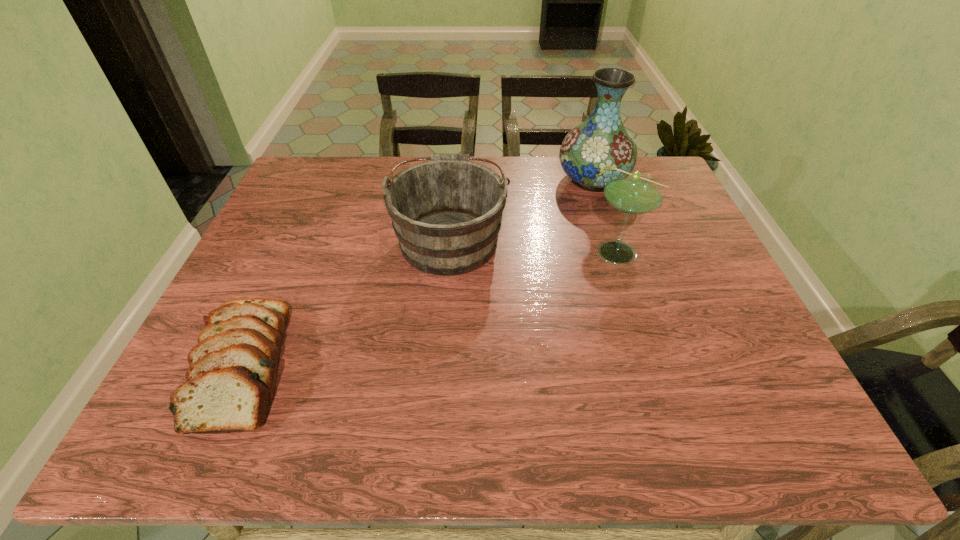
Identify the location of free space between the martini and the tallest object. The height and width of the screenshot is (540, 960). (607, 215).

This screenshot has height=540, width=960. Find the location of `free area in between the martini and the vase`. free area in between the martini and the vase is located at coordinates (607, 215).

Locate which object ranks second in proximity to the martini. Please provide its 2D coordinates. Your answer should be formatted as a tuple, i.e. [(x, y)], where the tuple contains the x and y coordinates of a point satisfying the conditions above.

[(446, 213)]

Select which object is the second closest to the nearest object. Please provide its 2D coordinates. Your answer should be formatted as a tuple, i.e. [(x, y)], where the tuple contains the x and y coordinates of a point satisfying the conditions above.

[(631, 192)]

What are the coordinates of `vacant area that satisfies the following two spatial constraints: 1. on the front side of the wine bucket; 2. on the right side of the martini` in the screenshot? It's located at (448, 252).

Locate an element on the screen. The height and width of the screenshot is (540, 960). vacant space that satisfies the following two spatial constraints: 1. on the back side of the wine bucket; 2. on the left side of the farthest object is located at coordinates (454, 180).

Identify the location of vacant point that satisfies the following two spatial constraints: 1. on the back side of the second object from left to right; 2. on the right side of the farthest object. (454, 180).